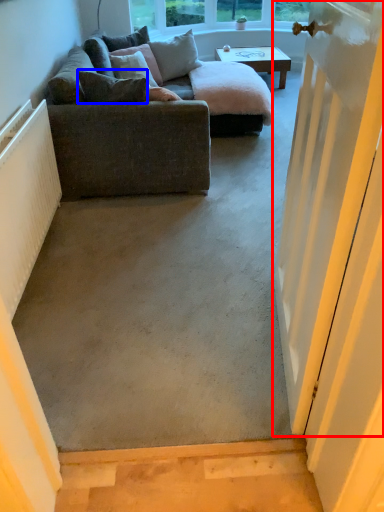
Question: Which object appears closest to the camera in this image, door (highlighted by a red box) or pillow (highlighted by a blue box)?

Choices:
 (A) door
 (B) pillow

Answer: (A)